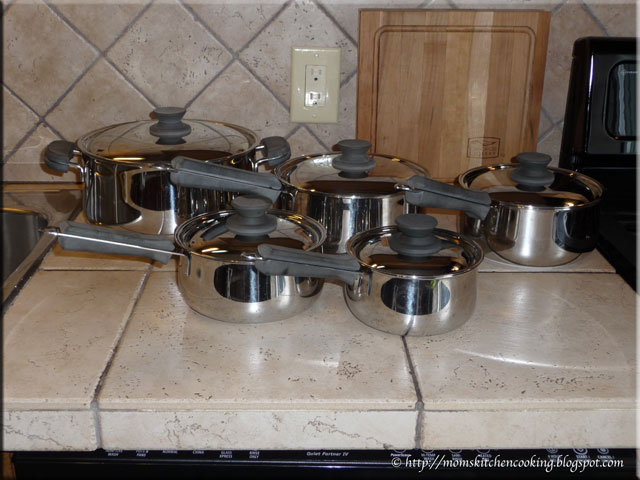
Identify the location of grout. tap(93, 399).